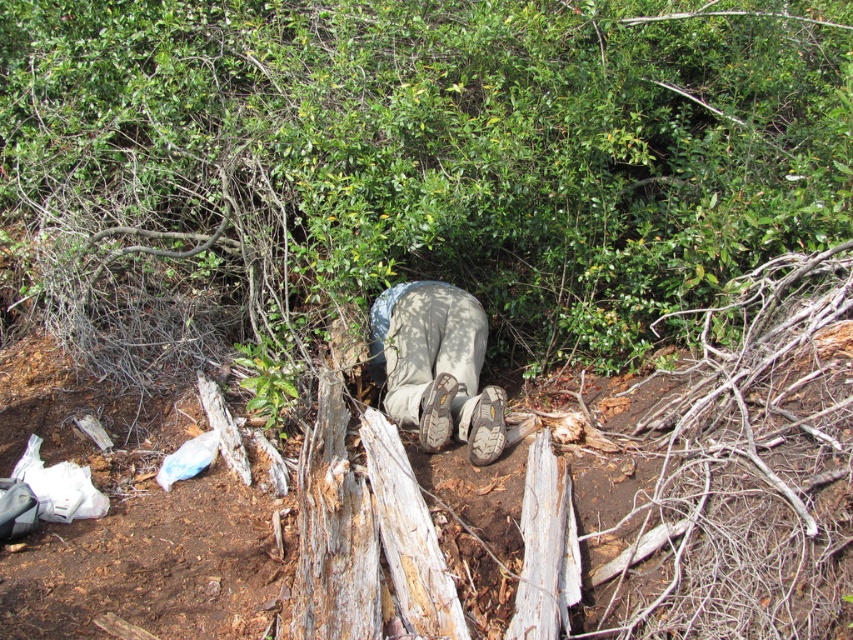
Is rough bark tree trunk at center thinner than brown suede boots at center?

No, rough bark tree trunk at center is not thinner than brown suede boots at center.

Does rough bark tree trunk at center have a greater height compared to brown suede boots at center?

Yes, rough bark tree trunk at center is taller than brown suede boots at center.

Describe the element at coordinates (415, 163) in the screenshot. I see `rough bark tree trunk at center` at that location.

You are a GUI agent. You are given a task and a screenshot of the screen. Output one action in this format:
    pyautogui.click(x=<x>, y=<y>)
    Task: Click on the rough bark tree trunk at center
    The image size is (853, 640).
    Given the screenshot: What is the action you would take?
    pyautogui.click(x=415, y=163)

Can you confirm if brown suede boots at center is taller than brown suede shoe at lower center?

Yes.

Can you confirm if brown suede boots at center is positioned above brown suede shoe at lower center?

Correct, brown suede boots at center is located above brown suede shoe at lower center.

Who is more distant from viewer, (380, 356) or (485, 435)?

The point (380, 356) is behind.

The height and width of the screenshot is (640, 853). In order to click on brown suede boots at center in this screenshot , I will do `click(436, 365)`.

Is point (699, 298) closer to camera compared to point (428, 442)?

No, (699, 298) is further to viewer.

Can you confirm if rough bark tree trunk at center is positioned to the left of brown suede shoe at center?

Yes, rough bark tree trunk at center is to the left of brown suede shoe at center.

Which is in front, point (518, 317) or point (445, 404)?

Point (445, 404) is in front.

This screenshot has height=640, width=853. I want to click on rough bark tree trunk at center, so click(x=415, y=163).